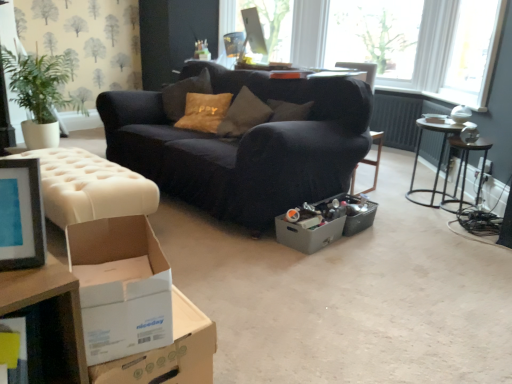
The height and width of the screenshot is (384, 512). Find the location of `empty space that is ontop of gray cardboard box at center, marked as the 3th cardboard box in a left-to-right arrangement (from a real-world perspective)`. empty space that is ontop of gray cardboard box at center, marked as the 3th cardboard box in a left-to-right arrangement (from a real-world perspective) is located at coordinates (312, 218).